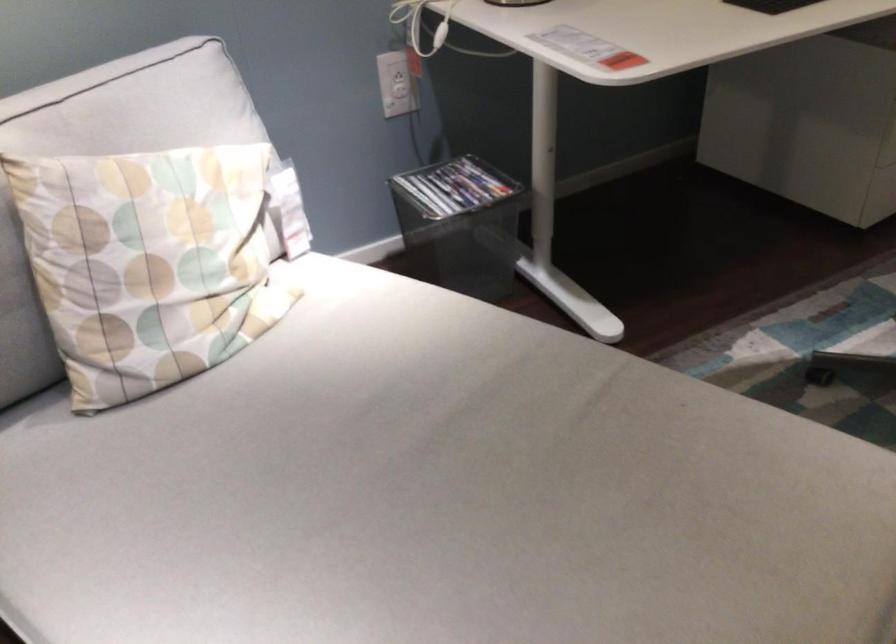
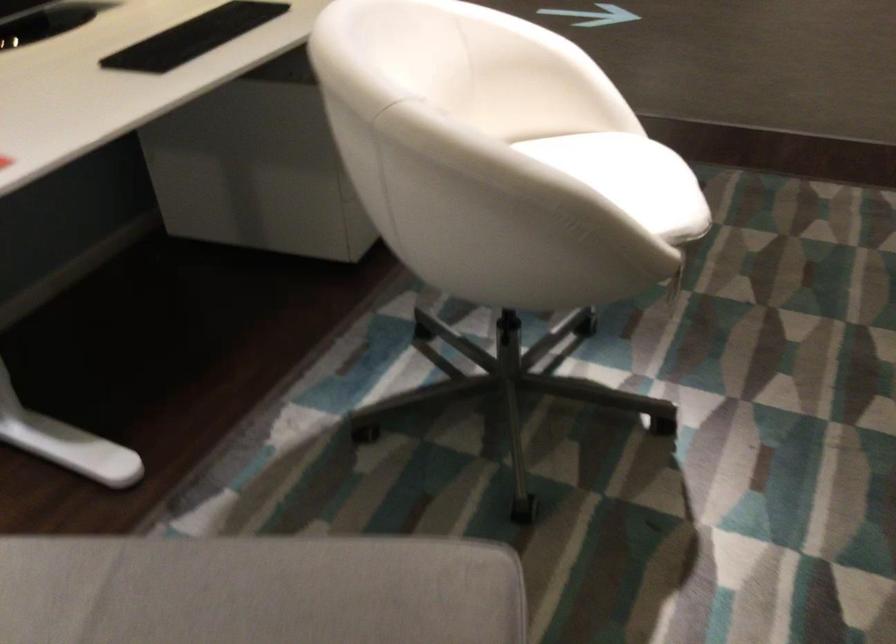
Question: The camera is either moving clockwise (left) or counter-clockwise (right) around the object. The first image is from the beginning of the video and the second image is from the end. Is the camera moving left or right when shooting the video?

Choices:
 (A) Left
 (B) Right

Answer: (A)